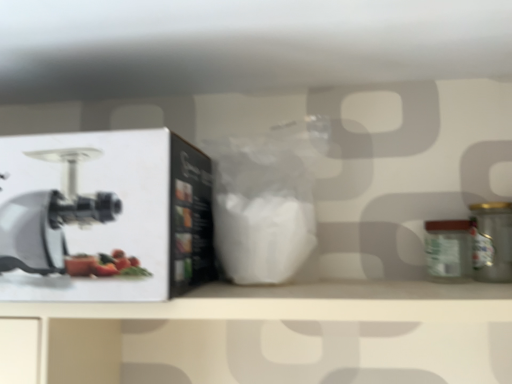
Question: Is green matte glass jar at right smaller than white matte box at left?

Choices:
 (A) yes
 (B) no

Answer: (A)

Question: From a real-world perspective, is green matte glass jar at right under white matte box at left?

Choices:
 (A) yes
 (B) no

Answer: (A)

Question: From a real-world perspective, is green matte glass jar at right over white matte box at left?

Choices:
 (A) no
 (B) yes

Answer: (A)

Question: Does green matte glass jar at right appear on the left side of white matte box at left?

Choices:
 (A) yes
 (B) no

Answer: (B)

Question: Considering the relative sizes of green matte glass jar at right and white matte box at left in the image provided, is green matte glass jar at right bigger than white matte box at left?

Choices:
 (A) no
 (B) yes

Answer: (A)

Question: Is white matte box at left at the back of green matte glass jar at right?

Choices:
 (A) yes
 (B) no

Answer: (B)

Question: Is green matte glass jar at right shorter than metallic gold canister at right?

Choices:
 (A) yes
 (B) no

Answer: (A)

Question: From the image's perspective, does green matte glass jar at right appear higher than metallic gold canister at right?

Choices:
 (A) no
 (B) yes

Answer: (A)

Question: Is green matte glass jar at right bigger than metallic gold canister at right?

Choices:
 (A) no
 (B) yes

Answer: (A)

Question: Considering the relative sizes of green matte glass jar at right and metallic gold canister at right in the image provided, is green matte glass jar at right smaller than metallic gold canister at right?

Choices:
 (A) no
 (B) yes

Answer: (B)

Question: Is green matte glass jar at right to the right of metallic gold canister at right from the viewer's perspective?

Choices:
 (A) yes
 (B) no

Answer: (B)

Question: Is green matte glass jar at right in front of metallic gold canister at right?

Choices:
 (A) no
 (B) yes

Answer: (A)

Question: Is metallic gold canister at right positioned with its back to green matte glass jar at right?

Choices:
 (A) yes
 (B) no

Answer: (B)